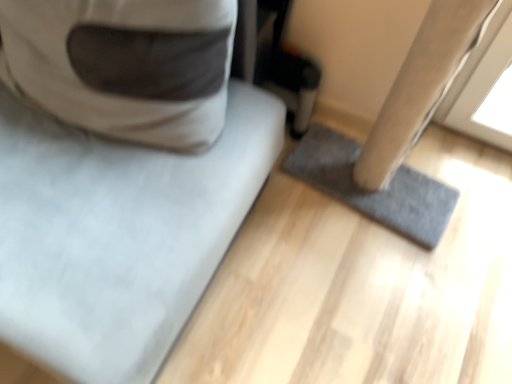
Question: Should I look upward or downward to see gray fabric cat bed at upper left?

Choices:
 (A) down
 (B) up

Answer: (B)